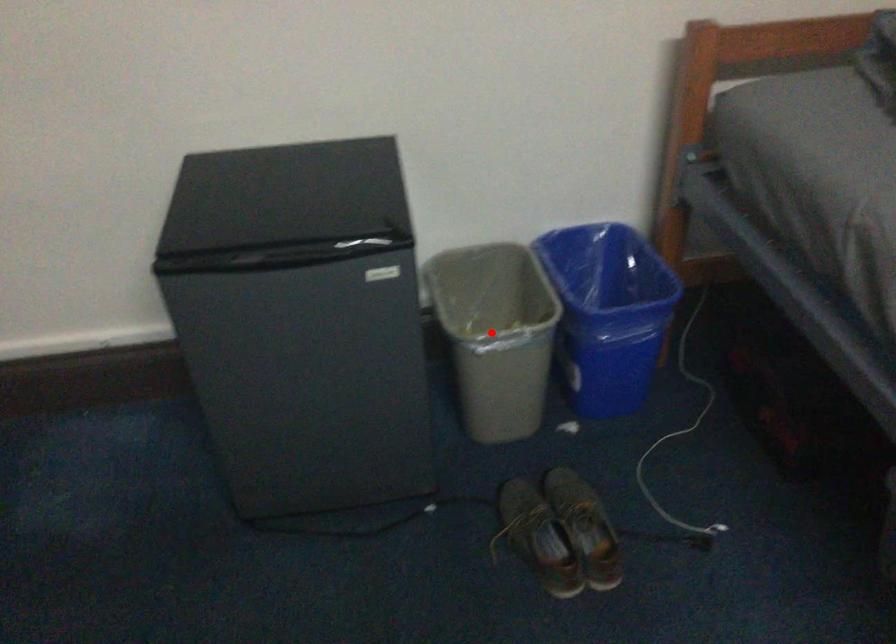
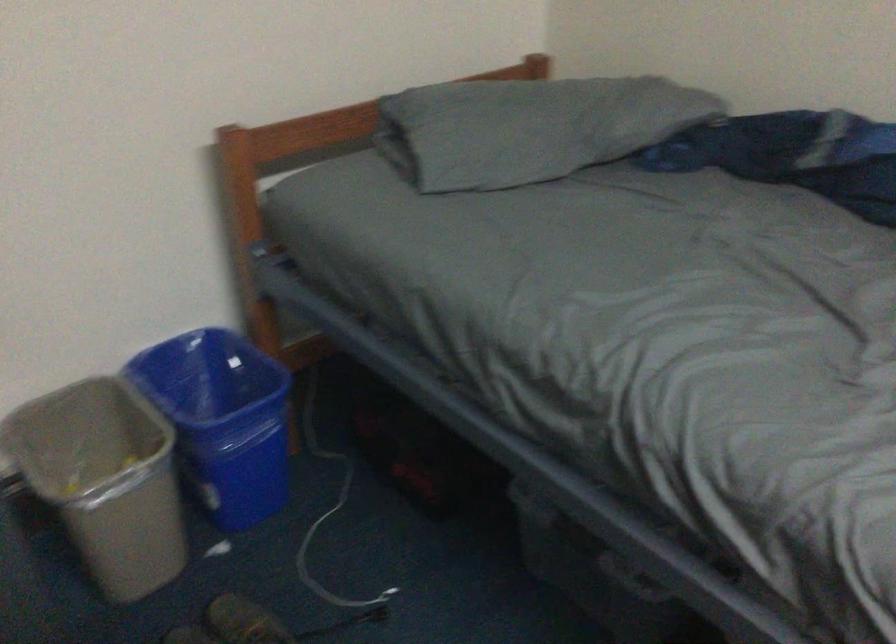
Find the pixel in the second image that matches the highlighted location in the first image.

(104, 480)